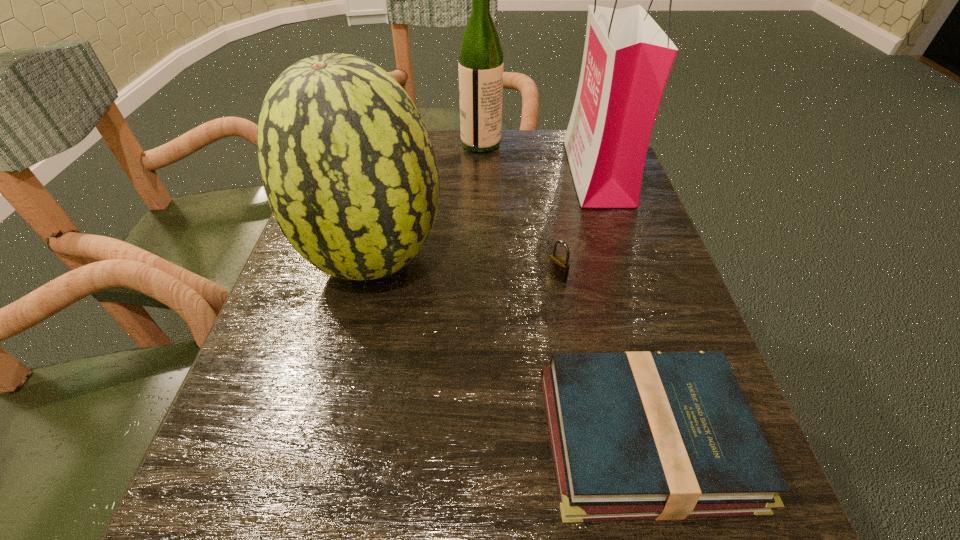
Identify the location of vacant region between the shopping bag and the second object from left to right. (540, 158).

Find the location of `vacant point located between the liquor and the nearest object`. vacant point located between the liquor and the nearest object is located at coordinates (563, 291).

Where is `free point between the shopping bag and the watermelon`? This screenshot has width=960, height=540. free point between the shopping bag and the watermelon is located at coordinates (486, 215).

The width and height of the screenshot is (960, 540). In order to click on empty space that is in between the fourth tallest object and the watermelon in this screenshot , I will do `click(466, 268)`.

Locate an element on the screen. vacant area that lies between the liquor and the padlock is located at coordinates (519, 210).

Where is `empty space that is in between the nearest object and the shopping bag`? empty space that is in between the nearest object and the shopping bag is located at coordinates (620, 305).

This screenshot has height=540, width=960. What are the coordinates of `object that is the fourth closest to the second shortest object` in the screenshot? It's located at (480, 66).

What are the coordinates of `object that is the fourth closest to the shopping bag` in the screenshot? It's located at (642, 435).

Locate an element on the screen. This screenshot has width=960, height=540. free space that satisfies the following two spatial constraints: 1. on the label of the fourth tallest object; 2. on the right side of the fourth object from right to left is located at coordinates (481, 276).